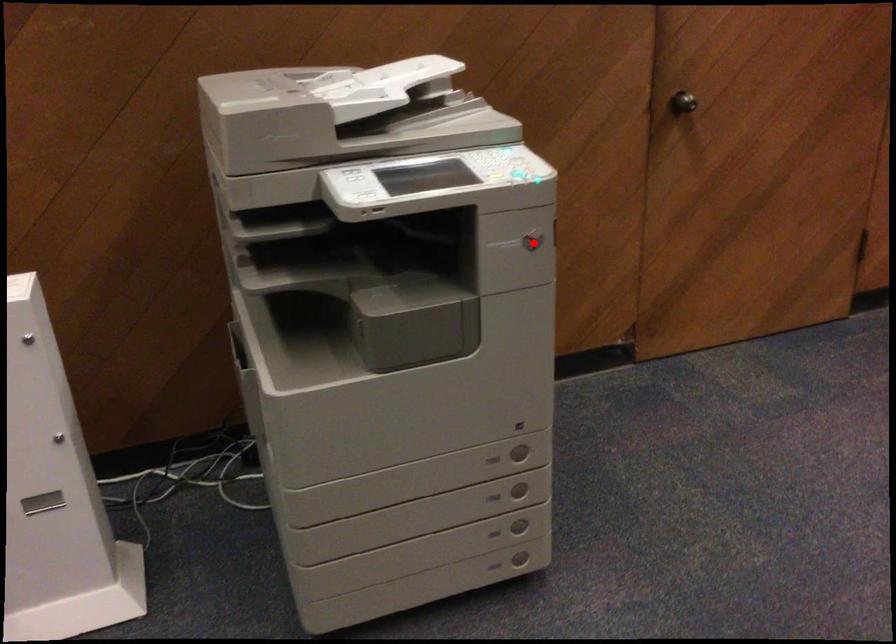
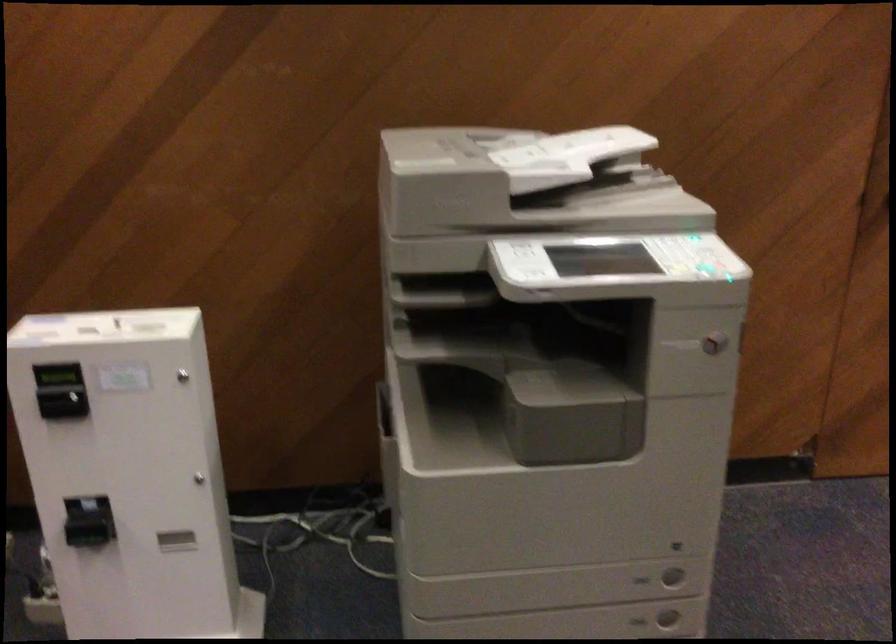
Question: I am providing you with two images of the same scene from different viewpoints. Given a red point in image1, look at the same physical point in image2. Is it:

Choices:
 (A) Closer to the viewpoint
 (B) Farther from the viewpoint

Answer: (A)